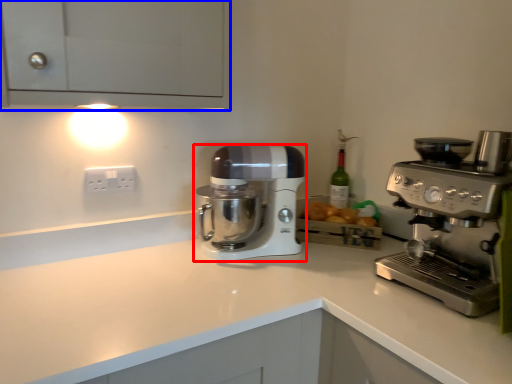
Question: Which object appears closest to the camera in this image, mixer (highlighted by a red box) or cabinetry (highlighted by a blue box)?

Choices:
 (A) mixer
 (B) cabinetry

Answer: (B)